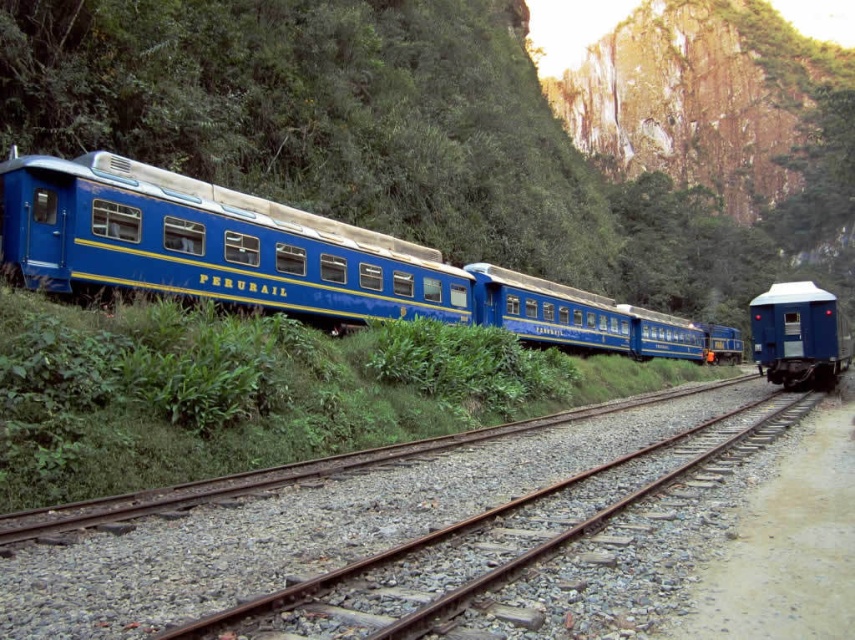
Between smooth gravel track at center and matte blue train car at right, which one appears on the left side from the viewer's perspective?

smooth gravel track at center

Who is lower down, smooth gravel track at center or matte blue train car at right?

smooth gravel track at center is below.

This screenshot has height=640, width=855. I want to click on smooth gravel track at center, so tap(314, 522).

Measure the distance between blue polished metal train at left and camera.

The distance of blue polished metal train at left from camera is 13.72 meters.

Image resolution: width=855 pixels, height=640 pixels. I want to click on blue polished metal train at left, so click(284, 259).

Is point (425, 298) positioned after point (466, 486)?

Yes, point (425, 298) is behind point (466, 486).

Where is `blue polished metal train at left`? This screenshot has width=855, height=640. blue polished metal train at left is located at coordinates (284, 259).

Between blue polished metal train at left and matte blue train car at right, which one has less height?

blue polished metal train at left

Is point (618, 323) closer to camera compared to point (817, 362)?

No, (618, 323) is further to viewer.

Who is more distant from viewer, (217, 237) or (783, 372)?

Positioned behind is point (783, 372).

The image size is (855, 640). What are the coordinates of `blue polished metal train at left` in the screenshot? It's located at (284, 259).